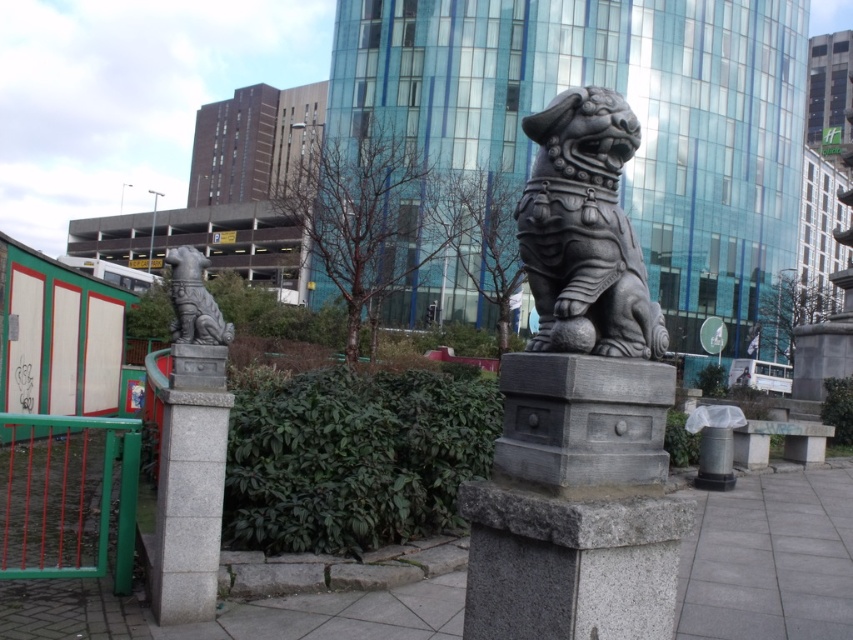
Consider the image. You are a delivery person trying to navigate through the area. You need to pass between the gray stone lion at center and the green painted metal fence at lower left. Can you fit through the space between them?

The gray stone lion at center has a smaller size compared to green painted metal fence at lower left, so the space between them may be sufficient for passage. However, without knowing the exact distance between them, it is difficult to confirm if the space is wide enough for a delivery person to pass through comfortably.

Consider the image. You are a delivery person trying to determine if your 6 feet tall package can fit through the space between the gray stone lion at center and the green painted metal fence at lower left. Can it pass through?

The gray stone lion at center is not as tall as the green painted metal fence at lower left, so the package can pass through the space between them since the fence is taller and the lion is shorter, providing enough vertical clearance.